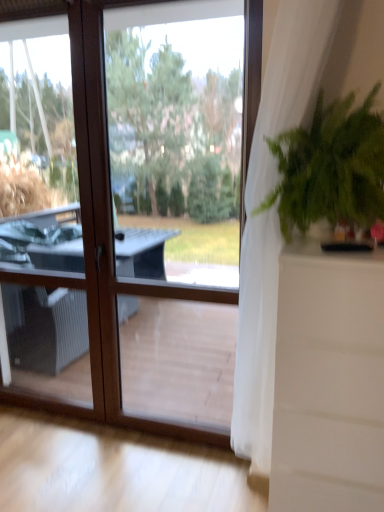
Question: From the image's perspective, relative to transparent glass window at center, is white sheer curtain at right above or below?

Choices:
 (A) above
 (B) below

Answer: (B)

Question: Is white sheer curtain at right wider or thinner than transparent glass window at center?

Choices:
 (A) thin
 (B) wide

Answer: (B)

Question: Considering the real-world distances, which object is farthest from the white sheer curtain at right?

Choices:
 (A) transparent glass window at center
 (B) green leafy plant at right

Answer: (A)

Question: Which is nearer to the transparent glass window at center?

Choices:
 (A) green leafy plant at right
 (B) white sheer curtain at right

Answer: (B)